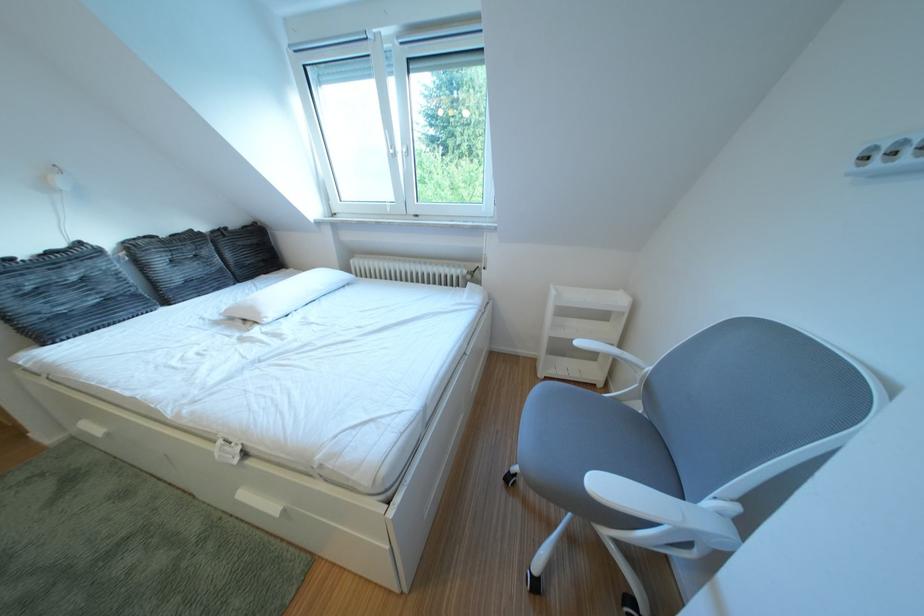
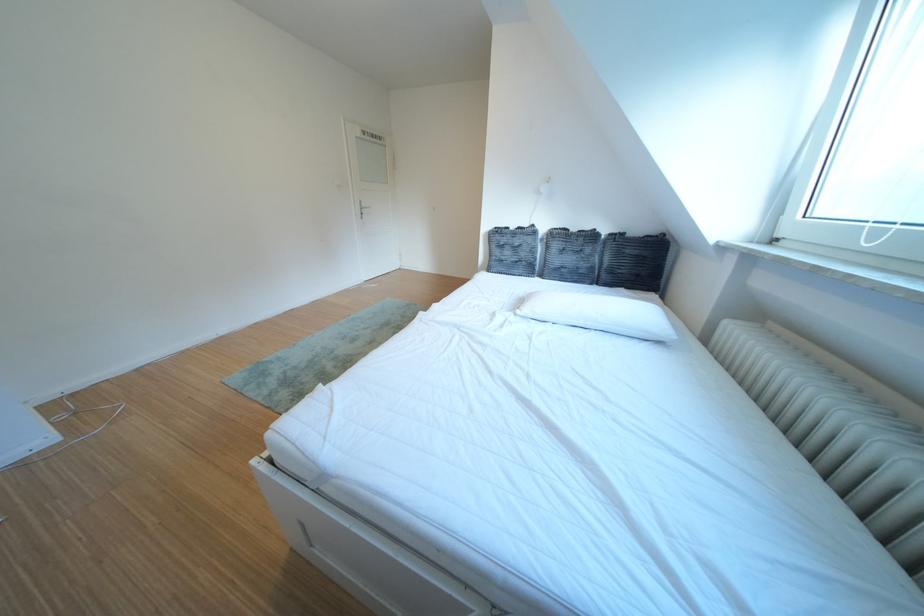
Find the pixel in the second image that matches point (284, 318) in the first image.

(540, 314)